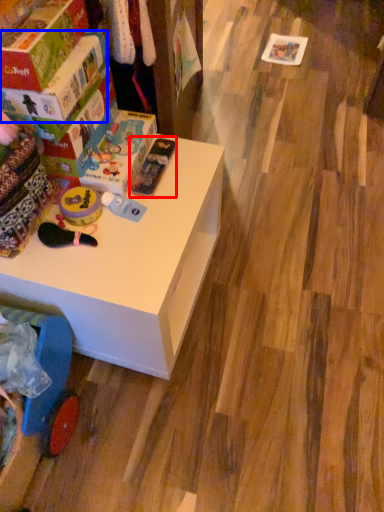
Question: Which point is closer to the camera, toy (highlighted by a red box) or box (highlighted by a blue box)?

Choices:
 (A) toy
 (B) box

Answer: (B)